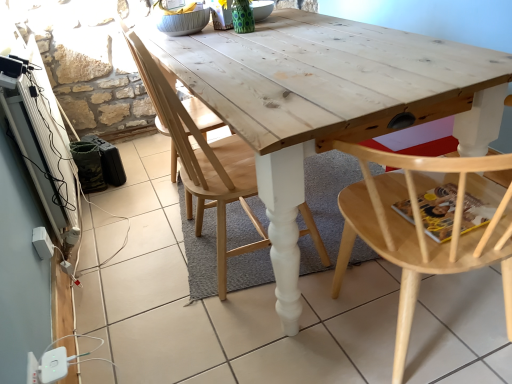
Where is `vacant space that is to the left of natural wood chair at center, positioned as the 3th chair in right-to-left order`? vacant space that is to the left of natural wood chair at center, positioned as the 3th chair in right-to-left order is located at coordinates (138, 196).